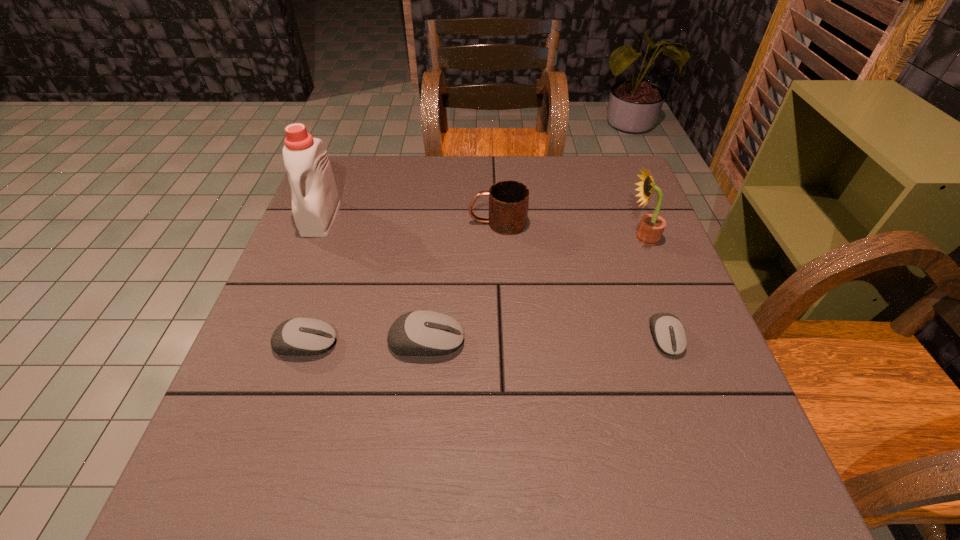
In order to click on object present at the far edge in this screenshot , I will do `click(315, 199)`.

At what (x,y) coordinates should I click in order to perform the action: click on computer equipment at the left edge. Please return your answer as a coordinate pair (x, y). Looking at the image, I should click on (303, 336).

The height and width of the screenshot is (540, 960). In order to click on detergent located at the left edge in this screenshot , I will do `click(315, 199)`.

Identify the location of computer equipment present at the right edge. Image resolution: width=960 pixels, height=540 pixels. point(669,334).

Find the location of a particular element. The image size is (960, 540). sunflower present at the right edge is located at coordinates (651, 227).

You are a GUI agent. You are given a task and a screenshot of the screen. Output one action in this format:
    pyautogui.click(x=<x>, y=<y>)
    Task: Click on the object present at the far left corner
    
    Given the screenshot: What is the action you would take?
    pyautogui.click(x=315, y=199)

Image resolution: width=960 pixels, height=540 pixels. In the image, there is a desktop. In order to click on vacant space at the far edge in this screenshot , I will do `click(507, 171)`.

Where is `vacant region at the near edge of the desktop`? The height and width of the screenshot is (540, 960). vacant region at the near edge of the desktop is located at coordinates click(625, 410).

Identify the location of free spot at the left edge of the desktop. The width and height of the screenshot is (960, 540). (316, 302).

You are a GUI agent. You are given a task and a screenshot of the screen. Output one action in this format:
    pyautogui.click(x=<x>, y=<y>)
    Task: Click on the blank space at the right edge of the desktop
    The width and height of the screenshot is (960, 540).
    Given the screenshot: What is the action you would take?
    pyautogui.click(x=614, y=221)